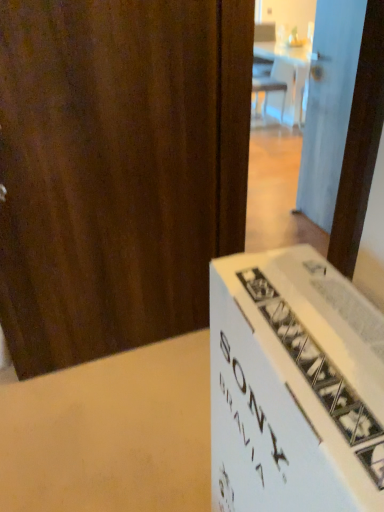
The width and height of the screenshot is (384, 512). What do you see at coordinates (329, 106) in the screenshot?
I see `white glossy door at upper right, which is the second door from front to back` at bounding box center [329, 106].

The height and width of the screenshot is (512, 384). Identify the location of white glossy door at upper right, the 1th door in the back-to-front sequence. (329, 106).

The height and width of the screenshot is (512, 384). I want to click on wooden door at left, the second door when ordered from right to left, so click(x=118, y=169).

Measure the distance between wooden door at left, the second door when ordered from right to left, and camera.

wooden door at left, the second door when ordered from right to left, and camera are 3.68 feet apart.

What is the approximate width of wooden door at left, placed as the 1th door when sorted from front to back?

It is 6.39 inches.

The height and width of the screenshot is (512, 384). Describe the element at coordinates (118, 169) in the screenshot. I see `wooden door at left, which is the first door in left-to-right order` at that location.

In order to click on white glossy door at upper right, the 2th door viewed from the left in this screenshot , I will do `click(329, 106)`.

Is wooden door at left, which is the first door in left-to-right order, to the left or to the right of white glossy door at upper right, the 2th door viewed from the left, in the image?

Based on their positions, wooden door at left, which is the first door in left-to-right order, is located to the left of white glossy door at upper right, the 2th door viewed from the left.

Between wooden door at left, the second door when ordered from right to left, and white glossy door at upper right, the 1th door in the back-to-front sequence, which one is positioned in front?

wooden door at left, the second door when ordered from right to left, is in front.

Is point (89, 148) in front of point (314, 220)?

Yes.

From the image's perspective, is wooden door at left, the second door when ordered from right to left, below white glossy door at upper right, the 2th door viewed from the left?

Indeed, from the image's perspective, wooden door at left, the second door when ordered from right to left, is shown beneath white glossy door at upper right, the 2th door viewed from the left.

From a real-world perspective, is wooden door at left, the second door in the back-to-front sequence, on white glossy door at upper right, which is the second door from front to back?

Yes.

Which object is thinner, wooden door at left, the second door in the back-to-front sequence, or white glossy door at upper right, placed as the 1th door when sorted from right to left?

Thinner between the two is white glossy door at upper right, placed as the 1th door when sorted from right to left.

Is wooden door at left, placed as the 1th door when sorted from front to back, taller than white glossy door at upper right, placed as the 1th door when sorted from right to left?

Correct, wooden door at left, placed as the 1th door when sorted from front to back, is much taller as white glossy door at upper right, placed as the 1th door when sorted from right to left.

Can you confirm if wooden door at left, the second door in the back-to-front sequence, is bigger than white glossy door at upper right, the 1th door in the back-to-front sequence?

Yes, wooden door at left, the second door in the back-to-front sequence, is bigger than white glossy door at upper right, the 1th door in the back-to-front sequence.

Could white glossy door at upper right, which is the second door from front to back, be considered to be inside wooden door at left, the second door in the back-to-front sequence?

No, white glossy door at upper right, which is the second door from front to back, is not inside wooden door at left, the second door in the back-to-front sequence.

Are wooden door at left, the second door when ordered from right to left, and white glossy door at upper right, the 2th door viewed from the left, located far from each other?

Yes, wooden door at left, the second door when ordered from right to left, is far from white glossy door at upper right, the 2th door viewed from the left.

Is wooden door at left, the second door in the back-to-front sequence, facing towards white glossy door at upper right, the 2th door viewed from the left?

No.

Could you measure the distance between wooden door at left, placed as the 1th door when sorted from front to back, and white glossy door at upper right, the 1th door in the back-to-front sequence?

wooden door at left, placed as the 1th door when sorted from front to back, and white glossy door at upper right, the 1th door in the back-to-front sequence, are 1.33 meters apart.

Identify the location of door directly beneath the wooden door at left, the second door in the back-to-front sequence (from a real-world perspective). The image size is (384, 512). (329, 106).

Can you confirm if white glossy door at upper right, placed as the 1th door when sorted from right to left, is positioned to the left of wooden door at left, placed as the 1th door when sorted from front to back?

In fact, white glossy door at upper right, placed as the 1th door when sorted from right to left, is to the right of wooden door at left, placed as the 1th door when sorted from front to back.

Is the position of white glossy door at upper right, placed as the 1th door when sorted from right to left, less distant than that of wooden door at left, which is the first door in left-to-right order?

No, it is not.

Between point (305, 170) and point (78, 361), which one is positioned in front?

The point (78, 361) is in front.

Based on the photo, from the image's perspective, would you say white glossy door at upper right, placed as the 1th door when sorted from right to left, is shown under wooden door at left, the second door in the back-to-front sequence?

No, from the image's perspective, white glossy door at upper right, placed as the 1th door when sorted from right to left, is not below wooden door at left, the second door in the back-to-front sequence.

From a real-world perspective, which object stands above the other?

wooden door at left, placed as the 1th door when sorted from front to back, is physically above.

Is white glossy door at upper right, the 1th door in the back-to-front sequence, thinner than wooden door at left, the second door in the back-to-front sequence?

Yes.

Who is shorter, white glossy door at upper right, the 1th door in the back-to-front sequence, or wooden door at left, the second door in the back-to-front sequence?

With less height is white glossy door at upper right, the 1th door in the back-to-front sequence.

Is white glossy door at upper right, placed as the 1th door when sorted from right to left, smaller than wooden door at left, the second door when ordered from right to left?

Indeed, white glossy door at upper right, placed as the 1th door when sorted from right to left, has a smaller size compared to wooden door at left, the second door when ordered from right to left.

Would you say white glossy door at upper right, the 2th door viewed from the left, contains wooden door at left, the second door in the back-to-front sequence?

That's incorrect, wooden door at left, the second door in the back-to-front sequence, is not inside white glossy door at upper right, the 2th door viewed from the left.

Is white glossy door at upper right, the 1th door in the back-to-front sequence, not near wooden door at left, the second door when ordered from right to left?

That's right, there is a large distance between white glossy door at upper right, the 1th door in the back-to-front sequence, and wooden door at left, the second door when ordered from right to left.

Could you tell me if white glossy door at upper right, placed as the 1th door when sorted from right to left, is facing wooden door at left, placed as the 1th door when sorted from front to back?

No, white glossy door at upper right, placed as the 1th door when sorted from right to left, is not oriented towards wooden door at left, placed as the 1th door when sorted from front to back.

How different are the orientations of white glossy door at upper right, placed as the 1th door when sorted from right to left, and wooden door at left, the second door when ordered from right to left, in degrees?

95.6 degrees.

How far apart are white glossy door at upper right, which is the second door from front to back, and wooden door at left, the second door in the back-to-front sequence?

white glossy door at upper right, which is the second door from front to back, and wooden door at left, the second door in the back-to-front sequence, are 4.38 feet apart from each other.

Where is `door lying above the wooden door at left, the second door when ordered from right to left (from the image's perspective)`? Image resolution: width=384 pixels, height=512 pixels. door lying above the wooden door at left, the second door when ordered from right to left (from the image's perspective) is located at coordinates (329, 106).

Locate an element on the screen. door above the wooden door at left, placed as the 1th door when sorted from front to back (from the image's perspective) is located at coordinates (329, 106).

At what (x,y) coordinates should I click in order to perform the action: click on door below the wooden door at left, placed as the 1th door when sorted from front to back (from a real-world perspective). Please return your answer as a coordinate pair (x, y). The height and width of the screenshot is (512, 384). Looking at the image, I should click on (329, 106).